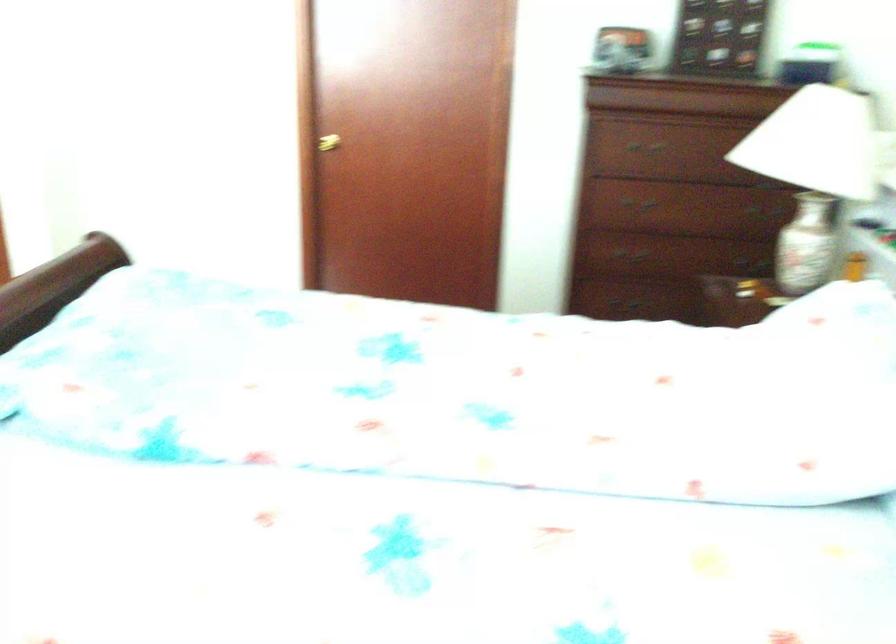
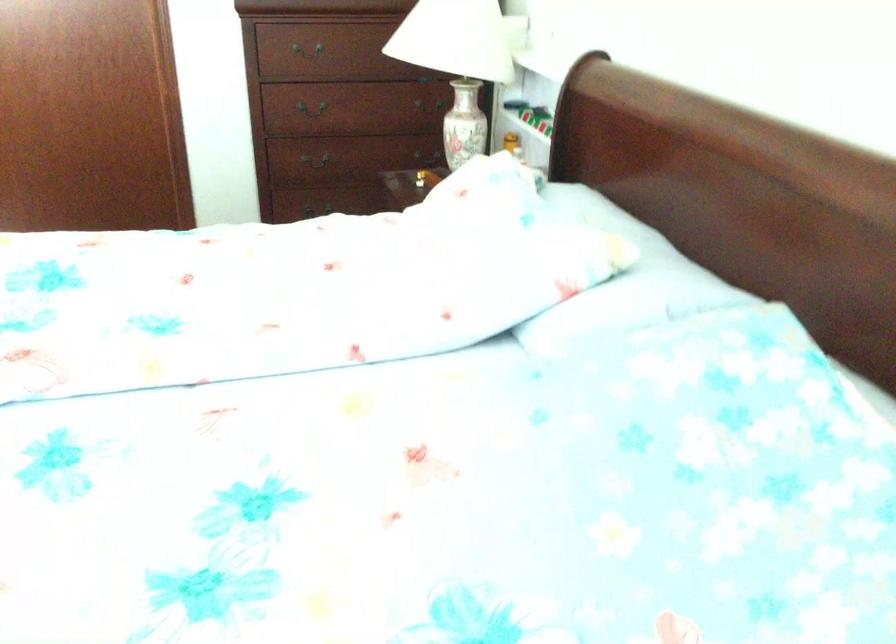
In the second image, find the point that corresponds to (x=643, y=254) in the first image.

(323, 158)